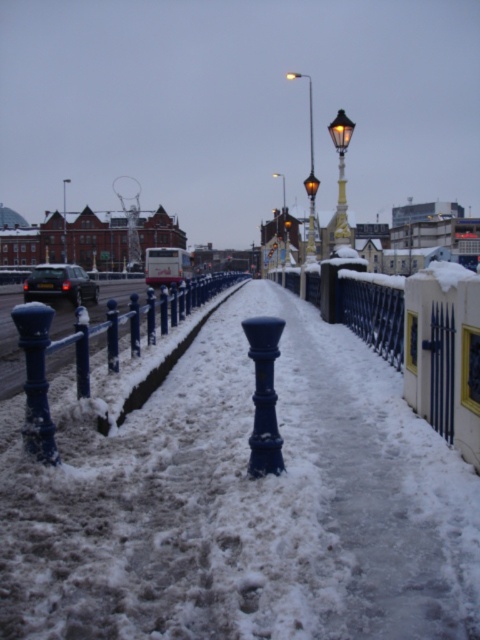
Question: Among these objects, which one is farthest from the camera?

Choices:
 (A) blue painted metal rail at center
 (B) matte black lamp post at upper center
 (C) blue painted metal fence at center
 (D) bronze textured streetlamp at center

Answer: (D)

Question: Can you confirm if matte black lamp post at center is bigger than bronze textured streetlamp at center?

Choices:
 (A) yes
 (B) no

Answer: (A)

Question: Does blue painted metal fence at center come behind glossy blue post at center?

Choices:
 (A) yes
 (B) no

Answer: (A)

Question: Can you confirm if glossy blue post at center is bigger than matte black lamp post at center?

Choices:
 (A) no
 (B) yes

Answer: (A)

Question: Which is farther from the bronze textured streetlamp at center?

Choices:
 (A) matte black lamp post at center
 (B) white snow at center
 (C) blue painted metal fence at center
 (D) matte black lamp post at upper center

Answer: (A)

Question: Among these points, which one is farthest from the camera?

Choices:
 (A) (72, 336)
 (B) (252, 440)
 (C) (285, 192)

Answer: (C)